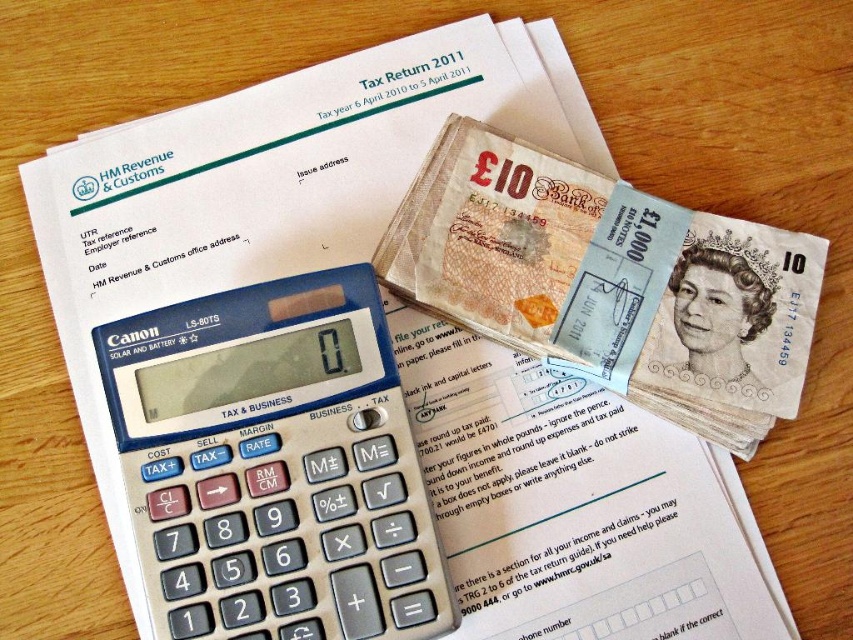
Question: Is silver metallic calculator at center below smooth paper £10 note at center?

Choices:
 (A) no
 (B) yes

Answer: (B)

Question: Which point is closer to the camera taking this photo?

Choices:
 (A) (354, 484)
 (B) (718, 230)

Answer: (A)

Question: Is silver metallic calculator at center above smooth paper £10 note at center?

Choices:
 (A) yes
 (B) no

Answer: (B)

Question: Which object is closer to the camera taking this photo?

Choices:
 (A) smooth paper £10 note at center
 (B) silver metallic calculator at center

Answer: (B)

Question: Which point appears closest to the camera in this image?

Choices:
 (A) (445, 308)
 (B) (341, 556)

Answer: (B)

Question: Is silver metallic calculator at center to the left of smooth paper £10 note at center from the viewer's perspective?

Choices:
 (A) yes
 (B) no

Answer: (A)